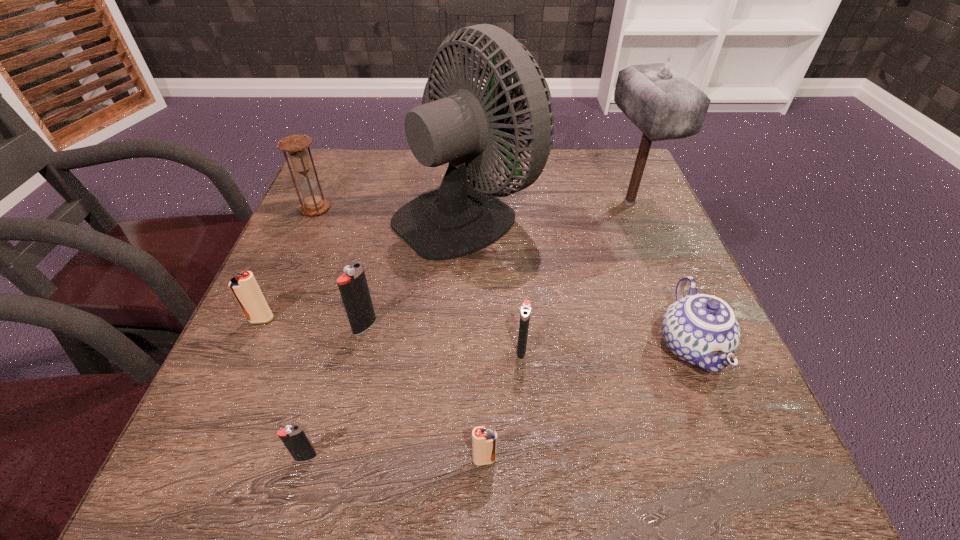
Find the location of `blue chinaware`. blue chinaware is located at coordinates (702, 330).

Where is `the second igniter from right to left`? the second igniter from right to left is located at coordinates (484, 441).

This screenshot has width=960, height=540. I want to click on the smaller red igniter, so click(x=484, y=441).

This screenshot has height=540, width=960. What are the coordinates of `the smallest black igniter` in the screenshot? It's located at (293, 437).

This screenshot has width=960, height=540. I want to click on the leftmost black igniter, so click(293, 437).

Where is `free space located in front of the gray fan to direct airflow`? This screenshot has width=960, height=540. free space located in front of the gray fan to direct airflow is located at coordinates (610, 212).

Where is `free spot located on the front of the mallet`? This screenshot has width=960, height=540. free spot located on the front of the mallet is located at coordinates (651, 257).

Where is `free space located on the right of the hourglass`? free space located on the right of the hourglass is located at coordinates (437, 208).

Where is `blank space located on the back of the biggest black igniter`? blank space located on the back of the biggest black igniter is located at coordinates (384, 245).

At what (x,y) coordinates should I click in order to perform the action: click on blank space located 0.100m on the left of the second biggest black igniter. Please return your answer as a coordinate pair (x, y). This screenshot has height=540, width=960. Looking at the image, I should click on (460, 350).